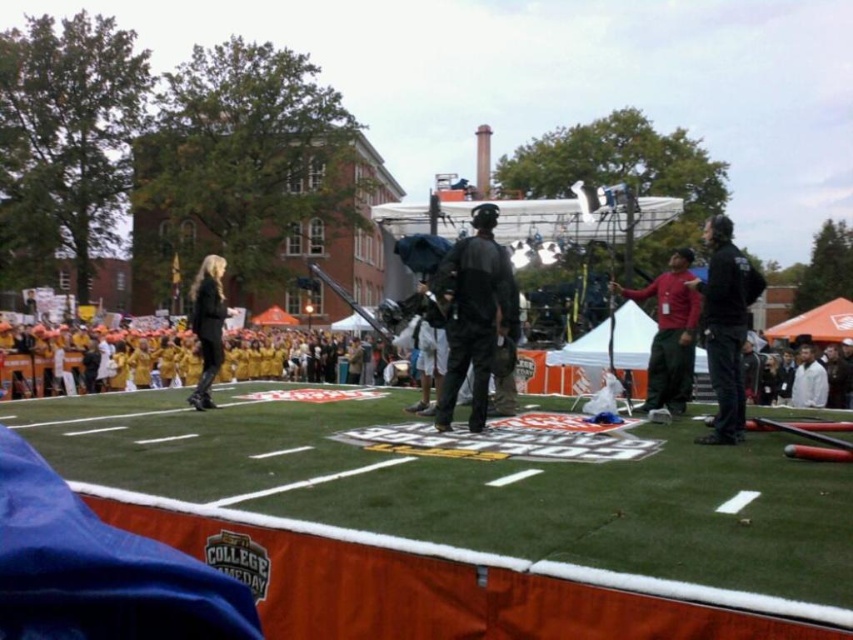
You are a photographer at the College GameDay event. You need to capture a photo that includes both the yellow fabric at center and the black matte jacket at upper right. Which object should you zoom in on to ensure both are visible in the frame?

The yellow fabric at center is larger in size than the black matte jacket at upper right, so you should zoom in on the yellow fabric at center to ensure both objects are visible in the frame.

You are a photographer standing at the edge of the field. You need to capture a clear shot of both the green artificial turf at center and the dark gray fabric jacket at center. Which object should you focus on first to ensure it appears sharp in the photo?

The green artificial turf at center is thinner than the dark gray fabric jacket at center, so you should focus on the dark gray fabric jacket at center first because thicker objects require more precise focus to appear sharp.